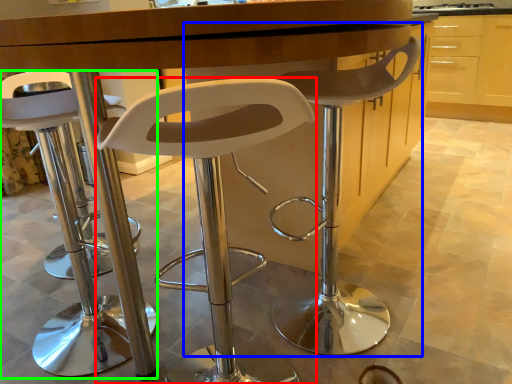
Question: Considering the real-world distances, which object is farthest from chair (highlighted by a red box)? chair (highlighted by a blue box) or chair (highlighted by a green box)?

Choices:
 (A) chair
 (B) chair

Answer: (B)